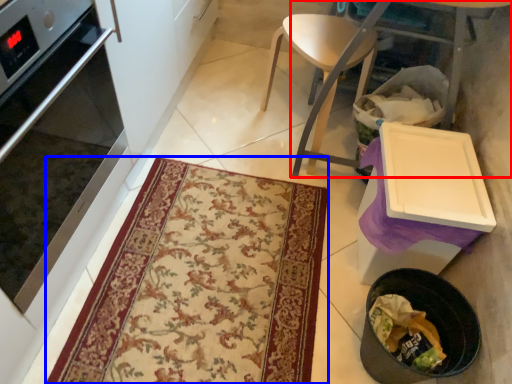
Question: Which object is further to the camera taking this photo, table (highlighted by a red box) or mat (highlighted by a blue box)?

Choices:
 (A) table
 (B) mat

Answer: (B)